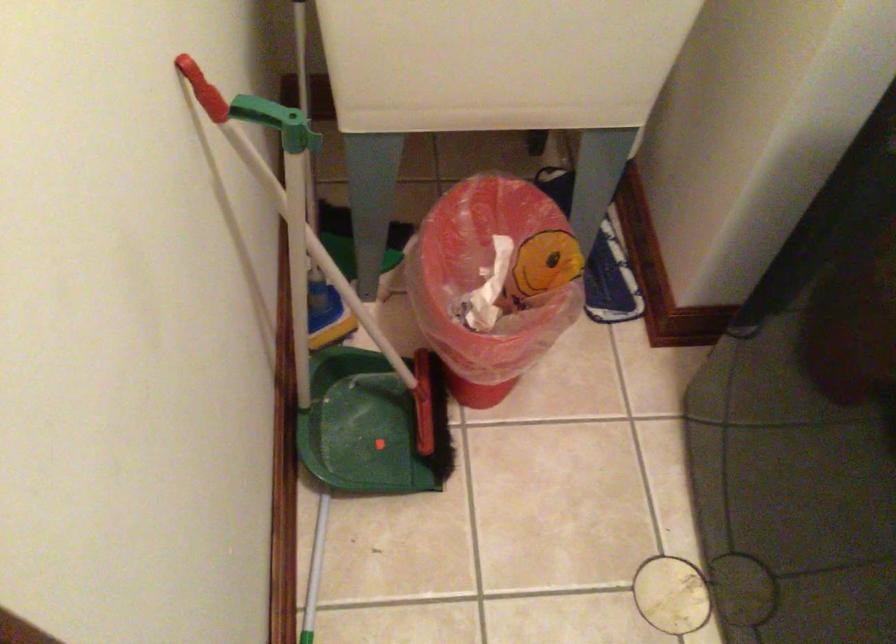
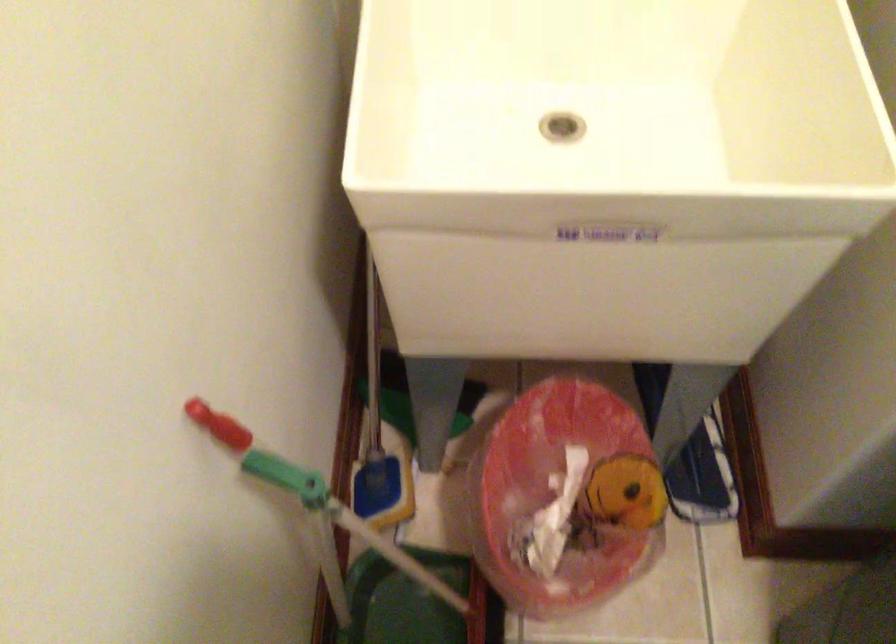
Where in the second image is the point corresponding to (314,304) from the first image?

(373, 483)